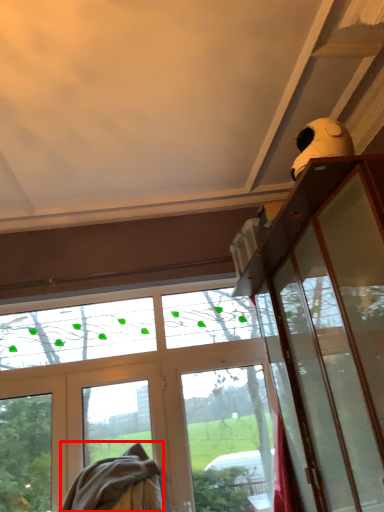
Question: From the image, what is the correct spatial relationship of blanket (annotated by the red box) in relation to screen door?

Choices:
 (A) left
 (B) right

Answer: (A)